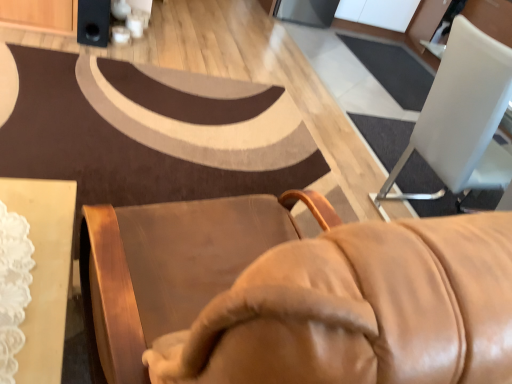
Question: Is point (102, 1) positioned closer to the camera than point (432, 150)?

Choices:
 (A) farther
 (B) closer

Answer: (A)

Question: Is black matte speaker at upper left situated inside white plastic chair at upper right or outside?

Choices:
 (A) outside
 (B) inside

Answer: (A)

Question: Based on their sizes in the image, would you say black matte speaker at upper left is bigger or smaller than white plastic chair at upper right?

Choices:
 (A) big
 (B) small

Answer: (B)

Question: Considering the positions of white plastic chair at upper right and black matte speaker at upper left in the image, is white plastic chair at upper right taller or shorter than black matte speaker at upper left?

Choices:
 (A) tall
 (B) short

Answer: (A)

Question: Visually, is white plastic chair at upper right positioned to the left or to the right of black matte speaker at upper left?

Choices:
 (A) right
 (B) left

Answer: (A)

Question: From the image's perspective, is white plastic chair at upper right located above or below black matte speaker at upper left?

Choices:
 (A) below
 (B) above

Answer: (A)

Question: From a real-world perspective, is white plastic chair at upper right above or below black matte speaker at upper left?

Choices:
 (A) below
 (B) above

Answer: (B)